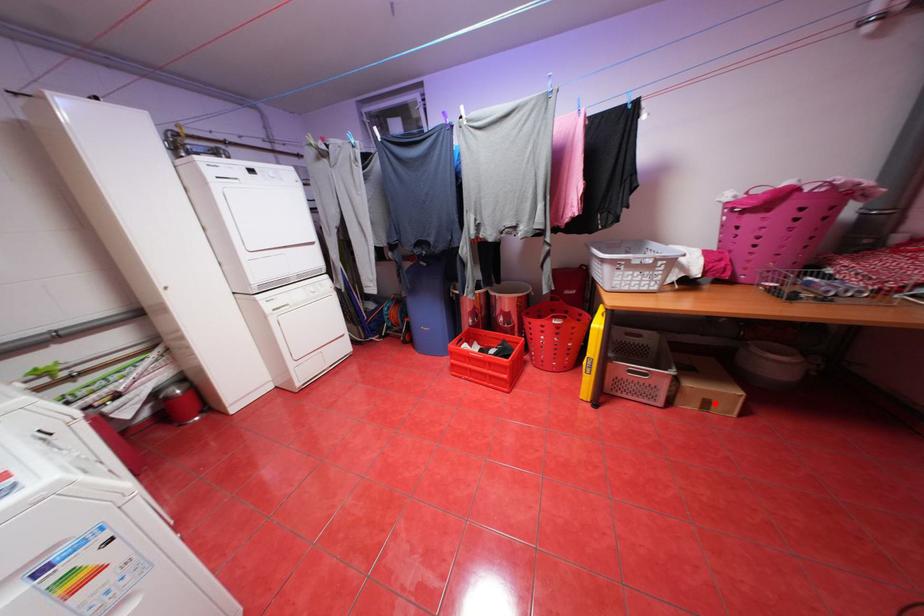
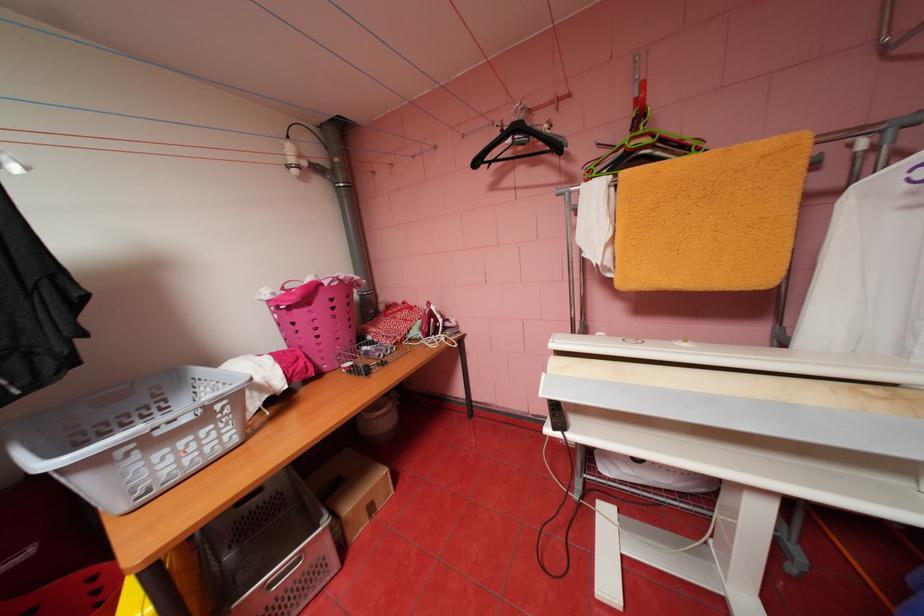
Question: I am providing you with two images of the same scene from different viewpoints. In image1, a red point is highlighted. Considering the same 3D point in image2, which of the following is correct?

Choices:
 (A) It is closer
 (B) It is farther

Answer: (B)